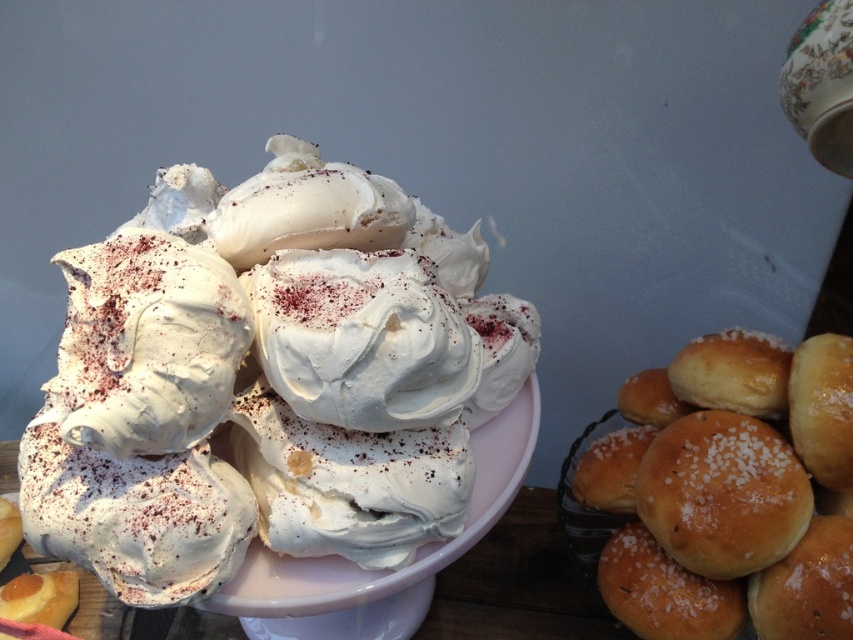
You are a customer at a bakery and want to know the exact position of the white fluffy meringue at center. Can you tell me its coordinates?

The white fluffy meringue at center is located at point (267, 380).

You are a customer at a bakery and want to take a photo of both the white fluffy meringue at center and the slightly golden bread at right. Since you want both items to be clearly visible in the frame, will you need to adjust your camera angle to ensure both are in focus?

The white fluffy meringue at center is in front of the slightly golden bread at right, so you will need to adjust your camera angle to ensure both are in focus as they are at different depths.